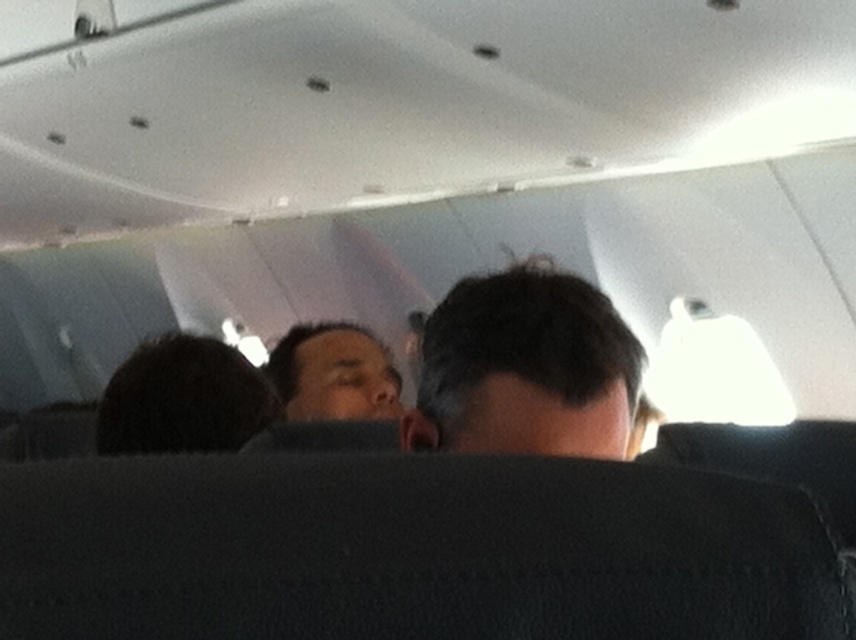
You are a passenger seated near the window in an airplane cabin. You notice a specific point at coordinates (334, 372). Based on the scene, where is this point located?

The point at (334, 372) is located on the matte skin face at center.